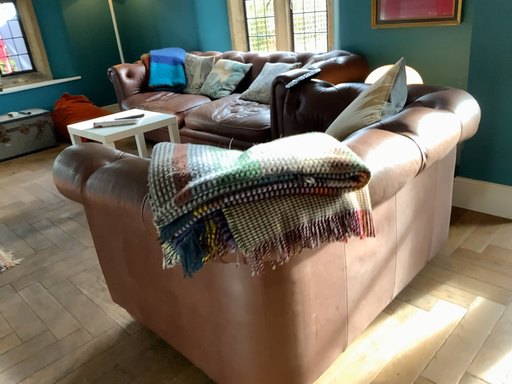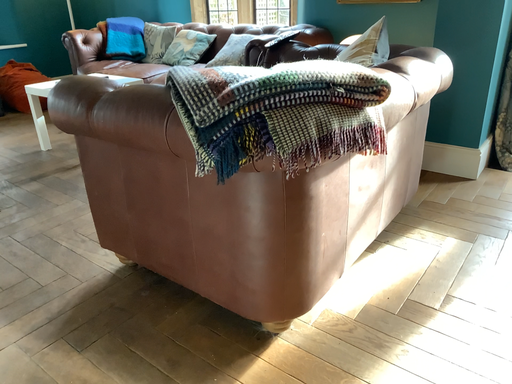
Question: Which way did the camera rotate in the video?

Choices:
 (A) rotated right
 (B) rotated left

Answer: (A)